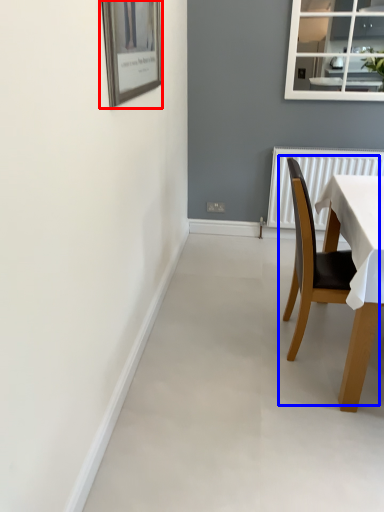
Question: Which of the following is the closest to the observer, picture frame (highlighted by a red box) or chair (highlighted by a blue box)?

Choices:
 (A) picture frame
 (B) chair

Answer: (A)